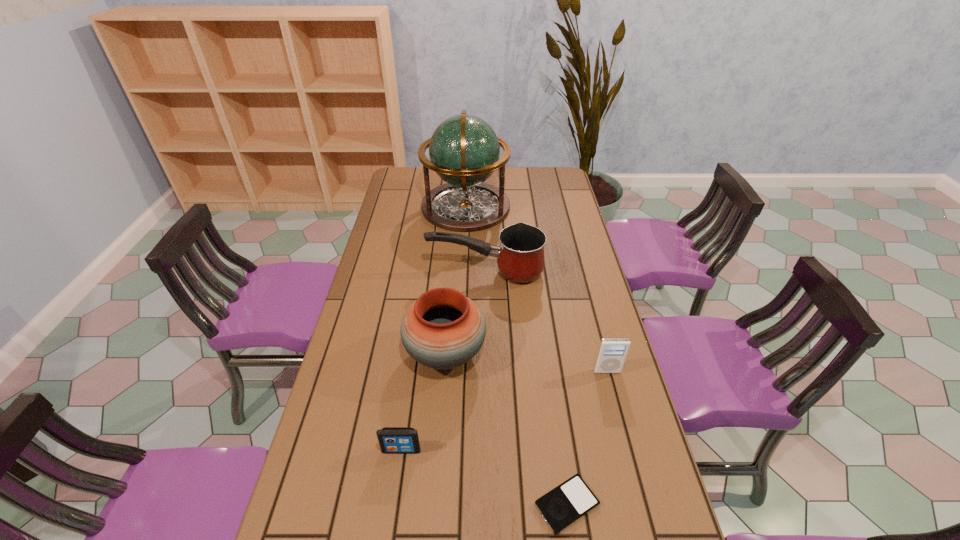
I want to click on the fourth closest object to the fifth farthest object, so click(x=520, y=257).

The image size is (960, 540). I want to click on iPod that is the nearest to the second farthest object, so click(612, 353).

Locate which iPod ranks in proximity to the second farthest iPod. Please provide its 2D coordinates. Your answer should be formatted as a tuple, i.e. [(x, y)], where the tuple contains the x and y coordinates of a point satisfying the conditions above.

[(568, 502)]

Identify the location of vacant point that satisfies the following two spatial constraints: 1. on the handle side of the nearest iPod; 2. on the left side of the fourth shortest object. (489, 504).

Find the location of `free spot that satisfies the following two spatial constraints: 1. on the back side of the shortest iPod; 2. on the front-facing side of the tallest object`. free spot that satisfies the following two spatial constraints: 1. on the back side of the shortest iPod; 2. on the front-facing side of the tallest object is located at coordinates (524, 207).

You are a GUI agent. You are given a task and a screenshot of the screen. Output one action in this format:
    pyautogui.click(x=<x>, y=<y>)
    Task: Click on the free point that satisfies the following two spatial constraints: 1. on the handle side of the saucepan; 2. on the front side of the pottery
    The image size is (960, 540).
    Given the screenshot: What is the action you would take?
    pyautogui.click(x=487, y=354)

Where is `free point that satisfies the following two spatial constraints: 1. on the front screen of the second nearest iPod; 2. on the right side of the nearest object`? The image size is (960, 540). free point that satisfies the following two spatial constraints: 1. on the front screen of the second nearest iPod; 2. on the right side of the nearest object is located at coordinates coord(394,504).

The image size is (960, 540). In order to click on vacant space that satisfies the following two spatial constraints: 1. on the handle side of the nearest object; 2. on the left side of the second farthest object in this screenshot , I will do `click(489, 504)`.